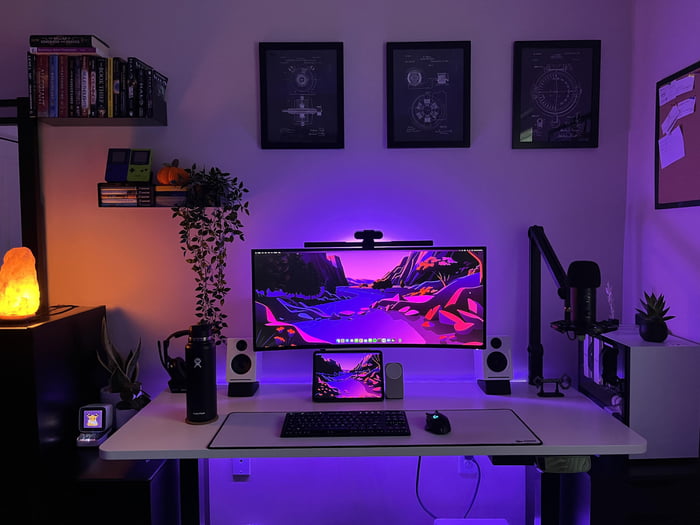
You are a GUI agent. You are given a task and a screenshot of the screen. Output one action in this format:
    pyautogui.click(x=<x>, y=<y>)
    Task: Click on the computer monitor
    Image resolution: width=700 pixels, height=525 pixels.
    Given the screenshot: What is the action you would take?
    pyautogui.click(x=355, y=375), pyautogui.click(x=358, y=282)